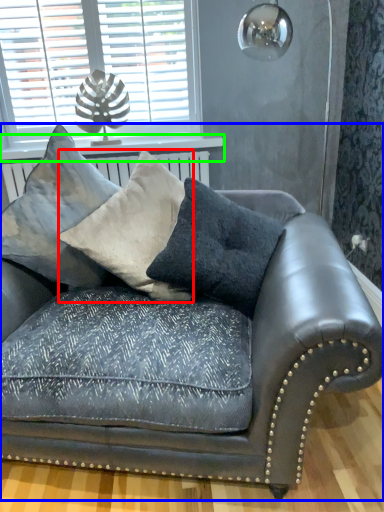
Question: Considering the real-world distances, which object is closest to pillow (highlighted by a red box)? studio couch (highlighted by a blue box) or window sill (highlighted by a green box).

Choices:
 (A) studio couch
 (B) window sill

Answer: (A)